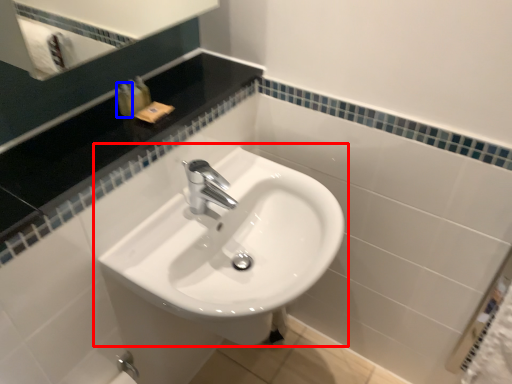
Question: Which object is closer to the camera taking this photo, sink (highlighted by a red box) or toiletry (highlighted by a blue box)?

Choices:
 (A) sink
 (B) toiletry

Answer: (A)